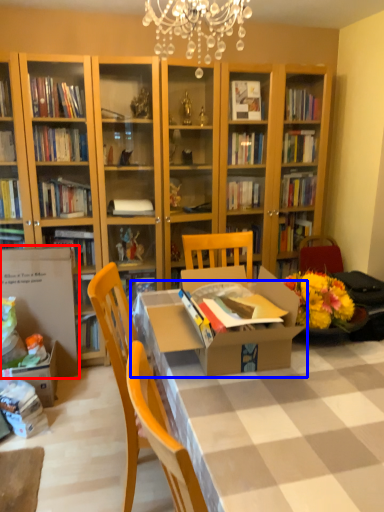
Question: Which of the following is the closest to the observer, cardboard box (highlighted by a red box) or table (highlighted by a blue box)?

Choices:
 (A) cardboard box
 (B) table

Answer: (B)